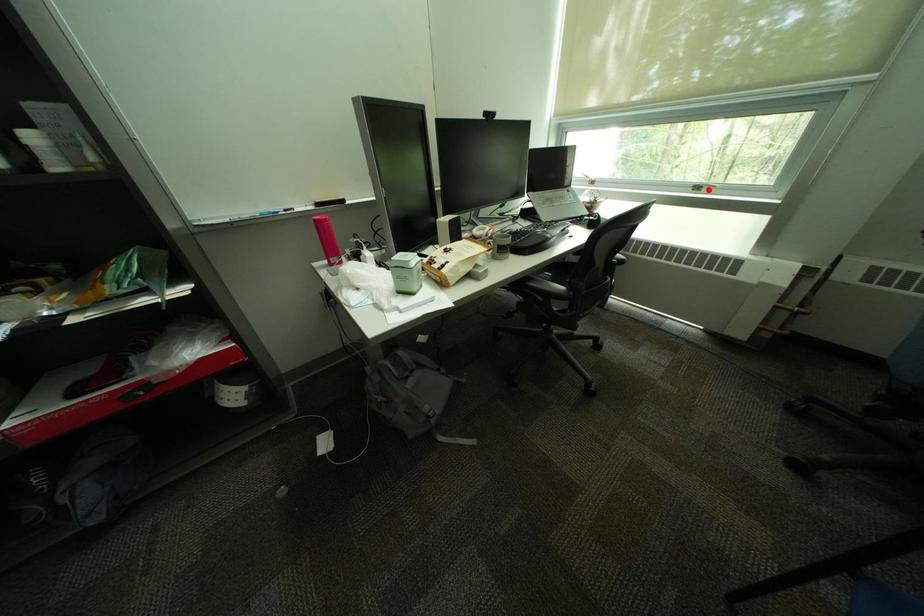
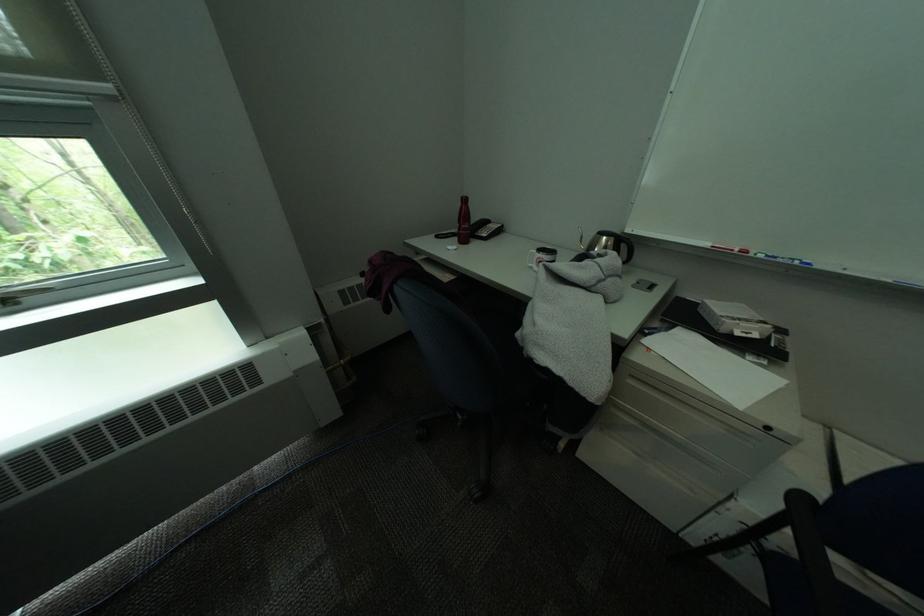
In the second image, find the point that corresponds to the highlighted location in the first image.

(15, 302)